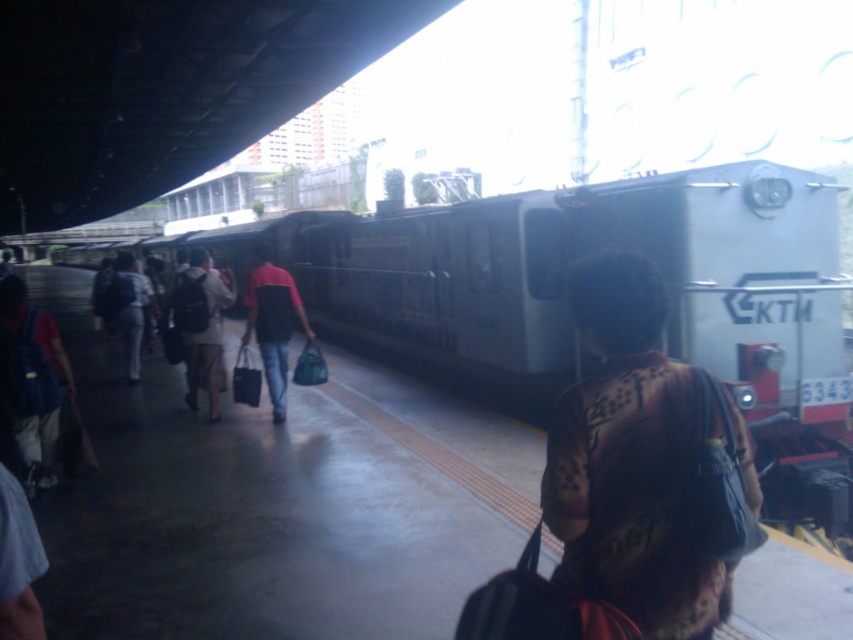
Question: Does silver metallic train at center appear on the left side of light brown backpack at center?

Choices:
 (A) no
 (B) yes

Answer: (B)

Question: Estimate the real-world distances between objects in this image. Which object is closer to the matte black backpack at left?

Choices:
 (A) dark red shirt at center
 (B) light brown backpack at center

Answer: (A)

Question: Does silver metallic train at center have a smaller size compared to matte black backpack at left?

Choices:
 (A) yes
 (B) no

Answer: (B)

Question: Among these points, which one is nearest to the camera?

Choices:
 (A) (190, 308)
 (B) (288, 288)
 (C) (9, 326)
 (D) (374, 308)

Answer: (C)

Question: Estimate the real-world distances between objects in this image. Which object is closer to the silver metallic train at center?

Choices:
 (A) printed fabric shirt at center
 (B) matte black backpack at left
 (C) light brown backpack at center

Answer: (C)

Question: Can you confirm if matte black backpack at left is thinner than dark red shirt at center?

Choices:
 (A) no
 (B) yes

Answer: (A)